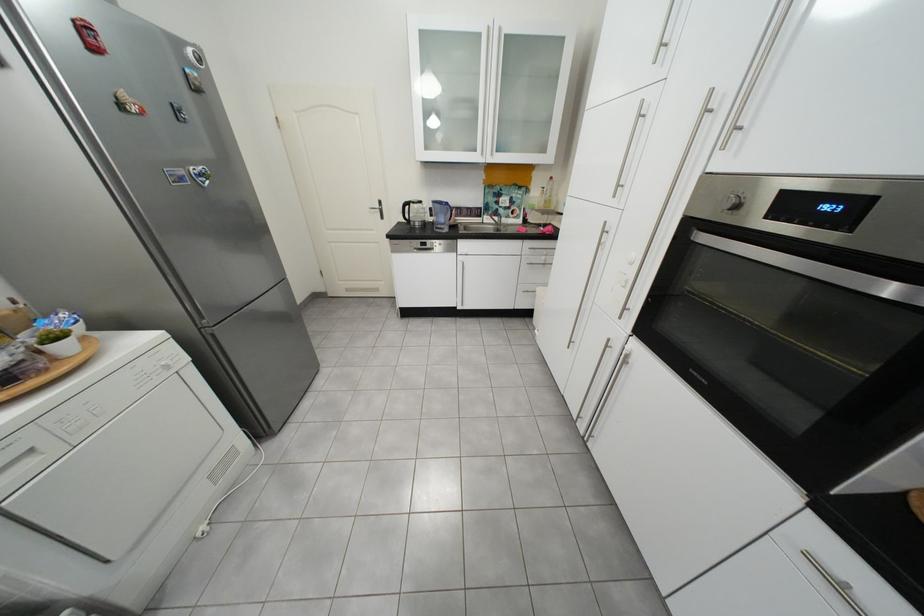
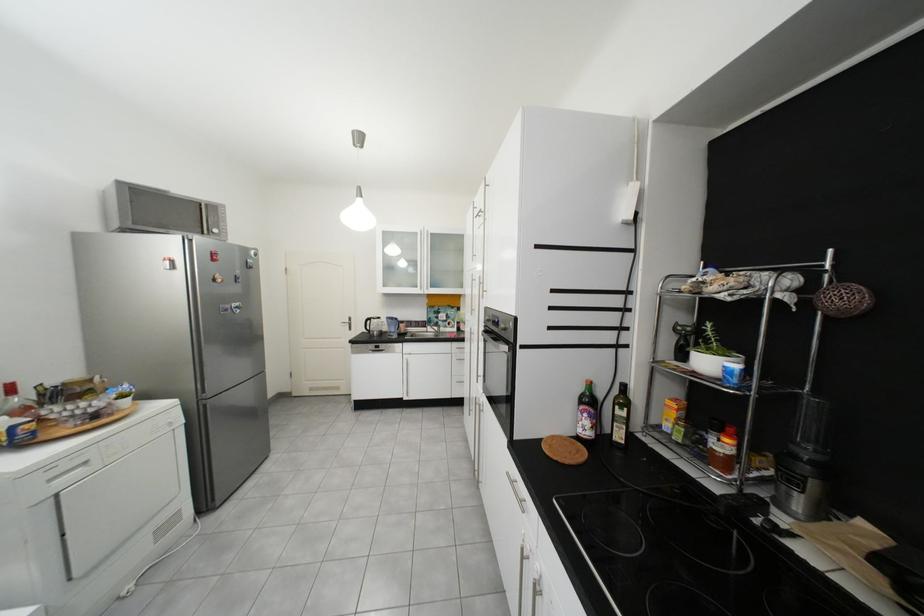
Question: How did the camera likely rotate?

Choices:
 (A) Left
 (B) Right
 (C) Up
 (D) Down

Answer: (C)